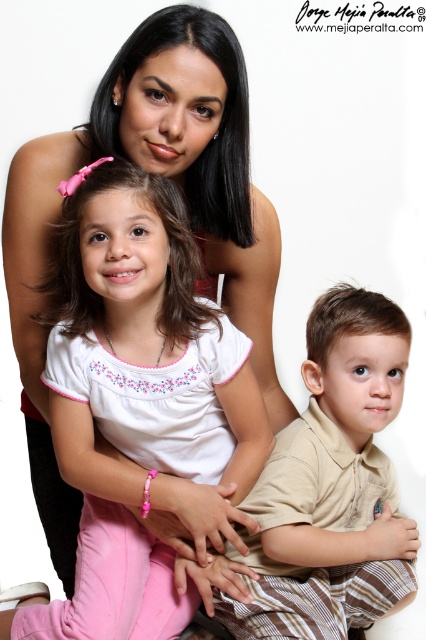
Is white cotton shirt at center taller than brown plaid pants at lower right?

Indeed, white cotton shirt at center has a greater height compared to brown plaid pants at lower right.

Can you confirm if white cotton shirt at center is positioned above brown plaid pants at lower right?

Indeed, white cotton shirt at center is positioned over brown plaid pants at lower right.

Who is more forward, (175, 381) or (333, 435)?

Positioned in front is point (175, 381).

Image resolution: width=426 pixels, height=640 pixels. In order to click on white cotton shirt at center in this screenshot , I will do `click(146, 337)`.